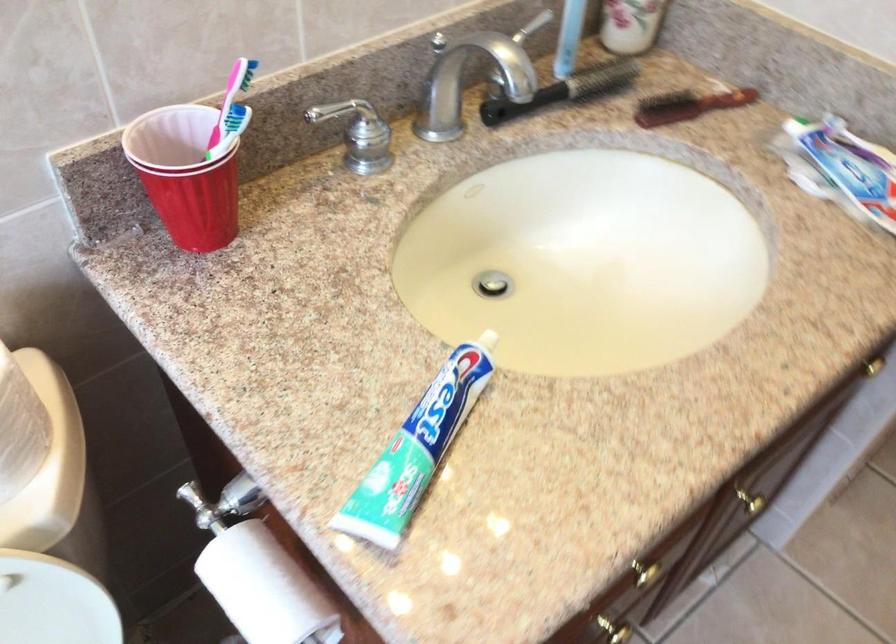
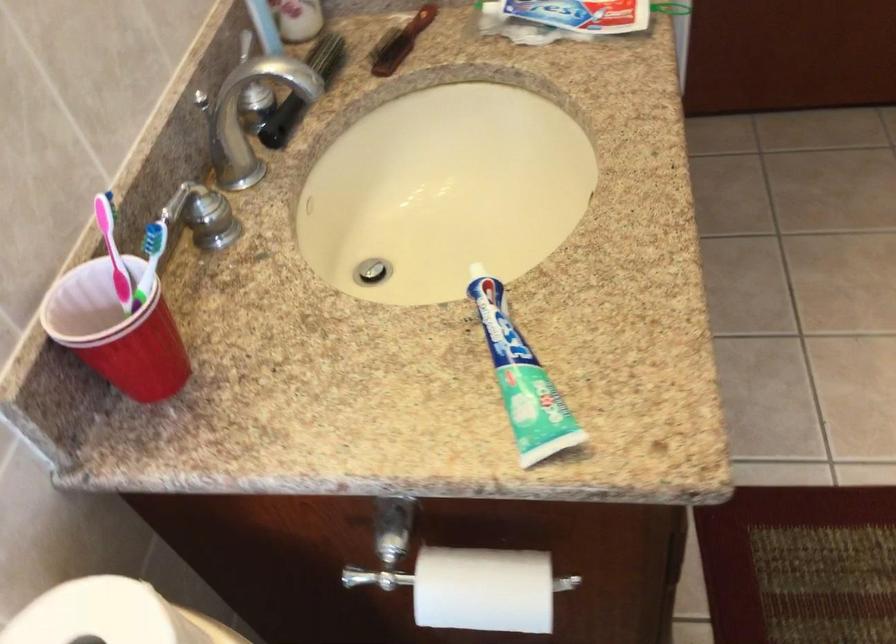
Locate, in the second image, the point that corresponds to pixel 228 109 in the first image.

(113, 251)